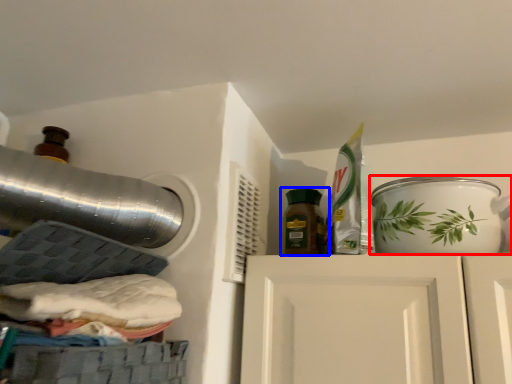
Question: Among these objects, which one is farthest to the camera, tableware (highlighted by a red box) or bottle (highlighted by a blue box)?

Choices:
 (A) tableware
 (B) bottle

Answer: (B)